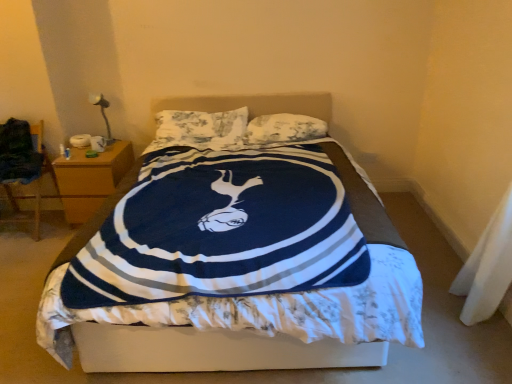
Question: Based on their sizes in the image, would you say wooden nightstand at left is bigger or smaller than metallic silver table lamp at upper left?

Choices:
 (A) small
 (B) big

Answer: (B)

Question: From the image's perspective, is wooden nightstand at left above or below metallic silver table lamp at upper left?

Choices:
 (A) above
 (B) below

Answer: (B)

Question: Considering the real-world distances, which object is farthest from the wooden nightstand at left?

Choices:
 (A) wooden chair at left
 (B) metallic silver table lamp at upper left
 (C) navy blue plush blanket at center
 (D) white fabric at lower right
 (E) fluffy white pillow at center, which ranks as the second pillow in left-to-right order

Answer: (D)

Question: Estimate the real-world distances between objects in this image. Which object is farther from the fluffy white pillow at center, which is the 1th pillow in right-to-left order?

Choices:
 (A) wooden chair at left
 (B) navy blue plush blanket at center
 (C) fluffy white pillow at center, the second pillow viewed from the right
 (D) wooden nightstand at left
 (E) metallic silver table lamp at upper left

Answer: (A)